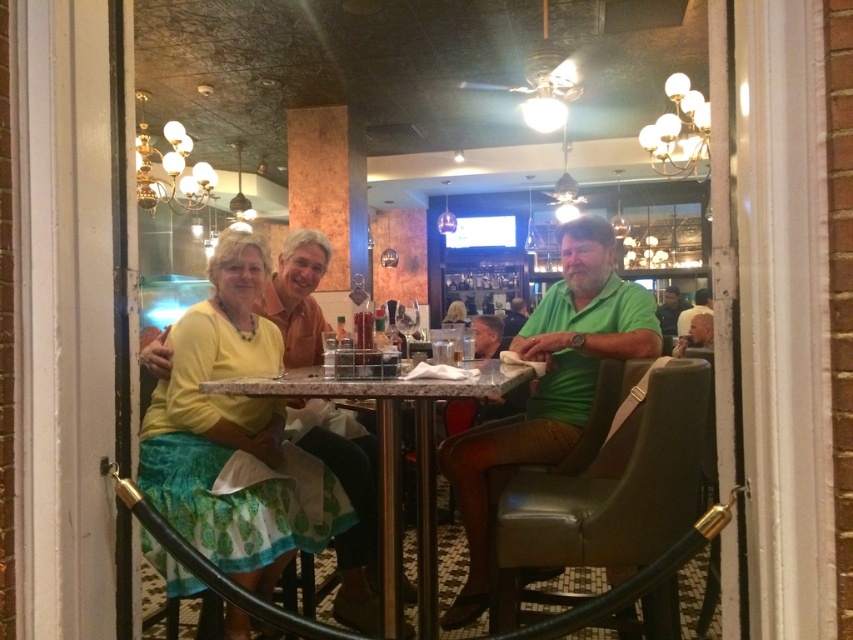
You are a customer entering the restaurant and see two people sitting at the table. One is wearing a green cotton shirt at right, and the other has a light brown leather jacket at upper right. Which clothing item is positioned more to the right side of the table?

The green cotton shirt at right is positioned more to the right side of the table than the light brown leather jacket at upper right.

You are a customer at the restaurant and want to place your phone on the marble table at center. However, you are wearing the matte green shirt at center. Will the shirt interfere with placing the phone on the table?

The marble table at center is much taller than the matte green shirt at center, so placing the phone on the table should not be affected by the shirt.